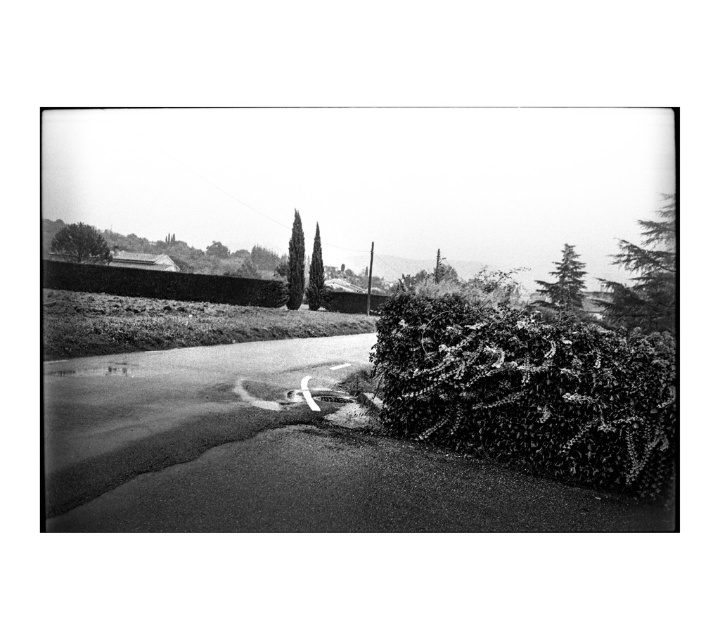
Question: Is fuzzy green bush at right further to the viewer compared to thick green hedge at center?

Choices:
 (A) yes
 (B) no

Answer: (B)

Question: Which is nearer to the needle-like evergreen at upper right?

Choices:
 (A) smooth green tree at center
 (B) fuzzy green bush at right

Answer: (B)

Question: Observing the image, what is the correct spatial positioning of thick green hedge at center in reference to smooth green cypress at center?

Choices:
 (A) below
 (B) above

Answer: (A)

Question: Is needle-like evergreen at upper right to the right of smooth green tree at center from the viewer's perspective?

Choices:
 (A) yes
 (B) no

Answer: (A)

Question: Based on their relative distances, which object is nearer to the green textured tree at upper right?

Choices:
 (A) smooth green cypress at center
 (B) thick green hedge at center
 (C) smooth green tree at center
 (D) needle-like evergreen at upper right

Answer: (D)

Question: Which point is farther to the camera?

Choices:
 (A) (643, 275)
 (B) (292, 230)
 (C) (243, 298)
 (D) (94, 248)

Answer: (D)